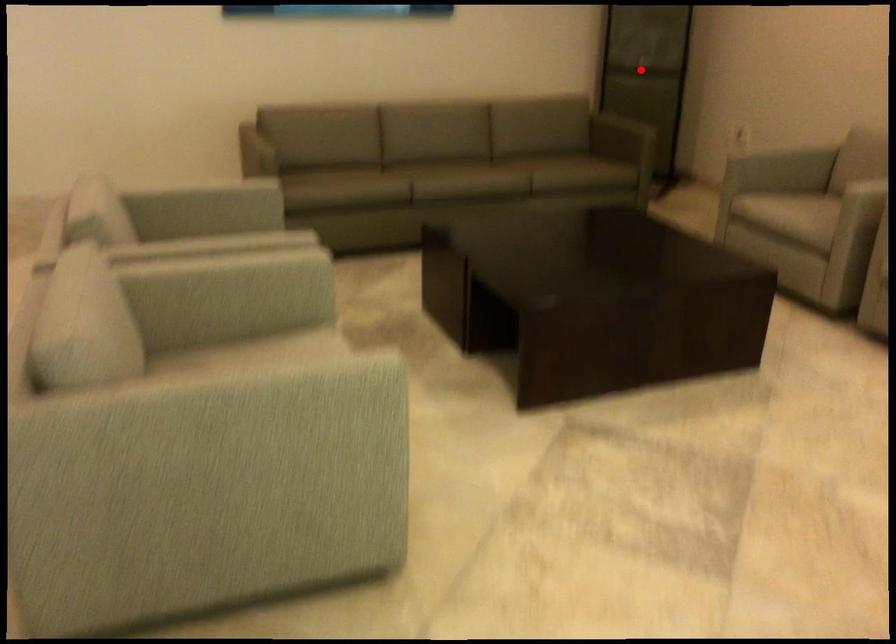
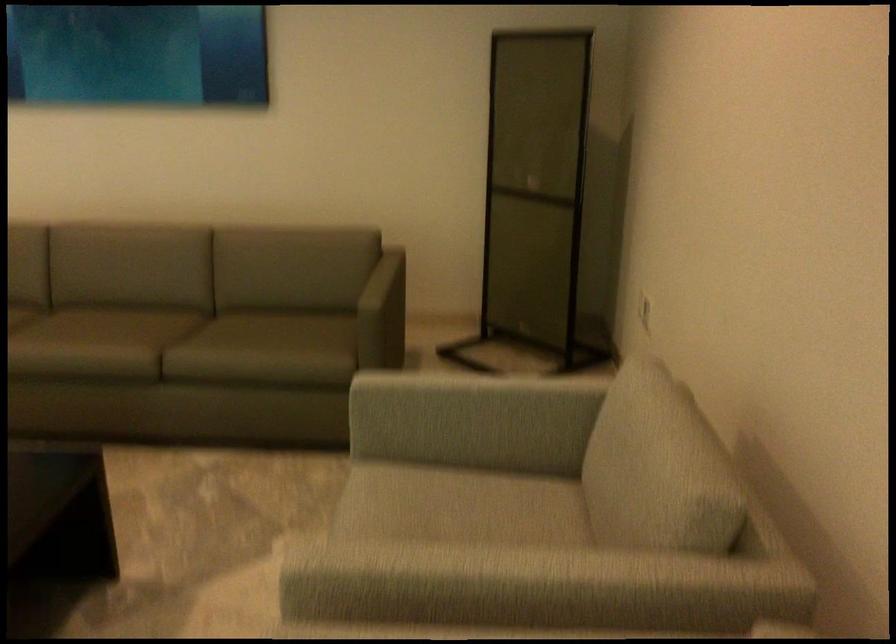
Question: I am providing you with two images of the same scene from different viewpoints. A red point is shown in image1. For the corresponding object point in image2, is it positioned nearer or farther from the camera?

Choices:
 (A) Nearer
 (B) Farther

Answer: (A)